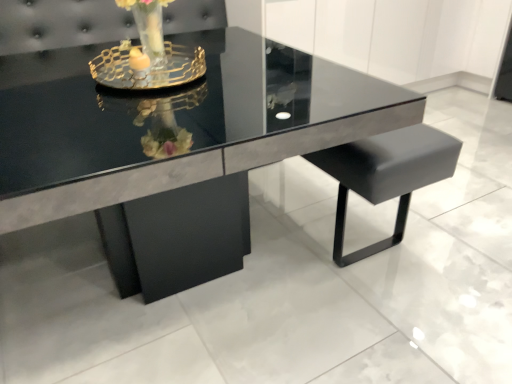
Question: Is gold metallic candle holder at upper center positioned behind glossy black table at center?

Choices:
 (A) no
 (B) yes

Answer: (B)

Question: Is gold metallic candle holder at upper center taller than glossy black table at center?

Choices:
 (A) yes
 (B) no

Answer: (B)

Question: Is gold metallic candle holder at upper center positioned before glossy black table at center?

Choices:
 (A) no
 (B) yes

Answer: (A)

Question: From a real-world perspective, is gold metallic candle holder at upper center positioned under glossy black table at center based on gravity?

Choices:
 (A) yes
 (B) no

Answer: (B)

Question: Is gold metallic candle holder at upper center facing towards glossy black table at center?

Choices:
 (A) yes
 (B) no

Answer: (B)

Question: Is gold metallic candle holder at upper center positioned beyond the bounds of glossy black table at center?

Choices:
 (A) yes
 (B) no

Answer: (A)

Question: Is glossy black table at center facing towards gold metallic candle holder at upper center?

Choices:
 (A) no
 (B) yes

Answer: (A)

Question: Can you confirm if glossy black table at center is bigger than gold metallic candle holder at upper center?

Choices:
 (A) no
 (B) yes

Answer: (B)

Question: Is the surface of glossy black table at center in direct contact with gold metallic candle holder at upper center?

Choices:
 (A) yes
 (B) no

Answer: (B)

Question: Does glossy black table at center have a smaller size compared to gold metallic candle holder at upper center?

Choices:
 (A) yes
 (B) no

Answer: (B)

Question: Considering the relative sizes of glossy black table at center and gold metallic candle holder at upper center in the image provided, is glossy black table at center taller than gold metallic candle holder at upper center?

Choices:
 (A) yes
 (B) no

Answer: (A)

Question: Is glossy black table at center oriented away from gold metallic candle holder at upper center?

Choices:
 (A) yes
 (B) no

Answer: (B)

Question: Considering the positions of glossy black table at center and gold metallic candle holder at upper center in the image, is glossy black table at center wider or thinner than gold metallic candle holder at upper center?

Choices:
 (A) wide
 (B) thin

Answer: (A)